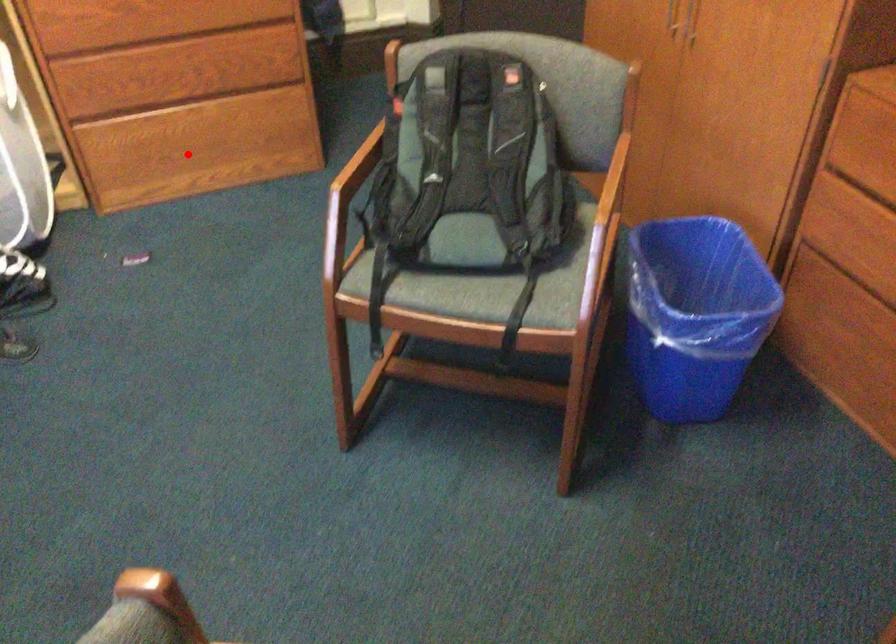
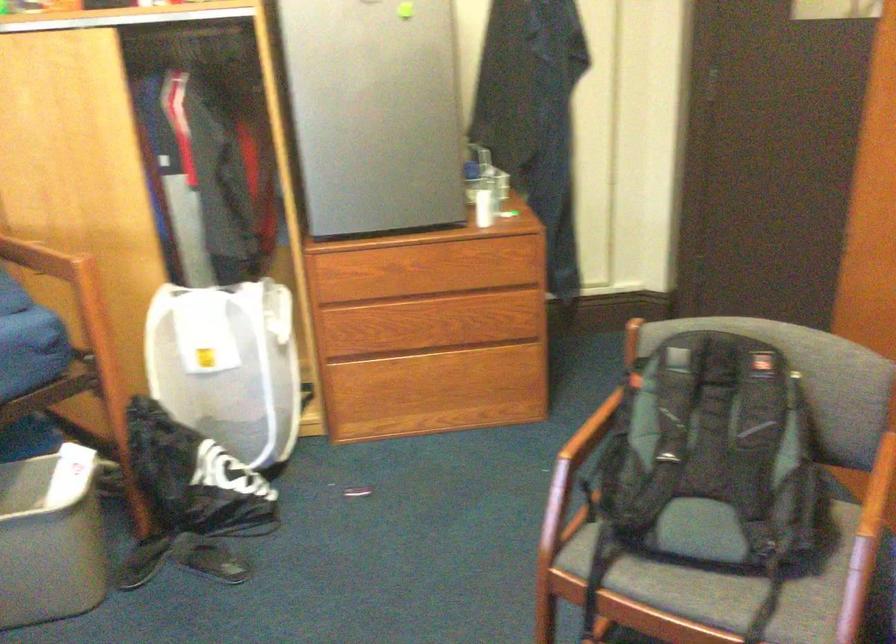
In the second image, find the point that corresponds to the highlighted location in the first image.

(419, 397)